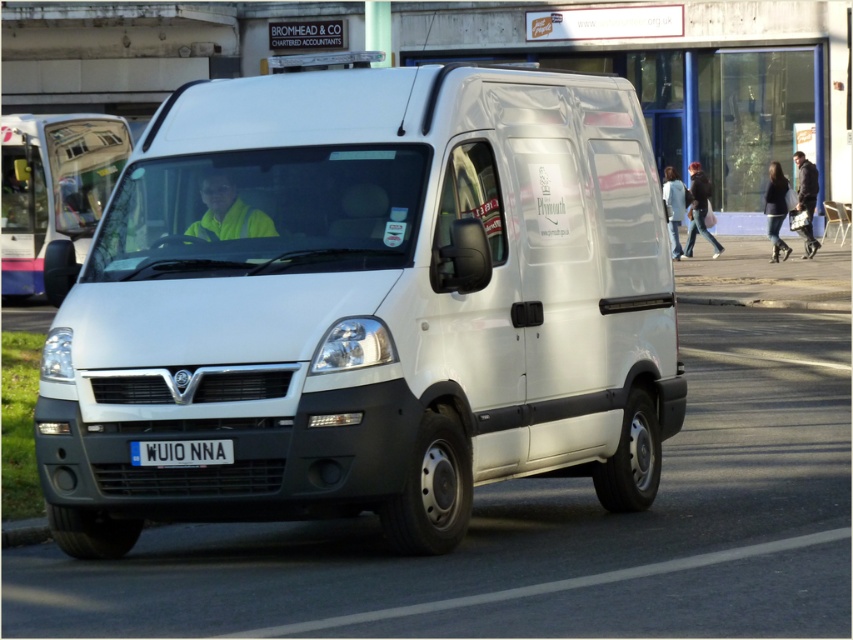
Between white matte van at center and white plastic license plate at center, which one appears on the left side from the viewer's perspective?

From the viewer's perspective, white plastic license plate at center appears more on the left side.

Does white matte van at center have a lesser height compared to white plastic license plate at center?

In fact, white matte van at center may be taller than white plastic license plate at center.

Where is `white matte van at center`? The image size is (853, 640). white matte van at center is located at coordinates (366, 305).

Which of these two, white matte van at center or matte white van at center, stands shorter?

white matte van at center

Who is more forward, (86, 404) or (3, 228)?

Positioned in front is point (86, 404).

Where is `white matte van at center`? The height and width of the screenshot is (640, 853). white matte van at center is located at coordinates (366, 305).

Is matte white van at center shorter than white plastic license plate at center?

In fact, matte white van at center may be taller than white plastic license plate at center.

Is point (22, 182) closer to viewer compared to point (198, 456)?

That is False.

In order to click on matte white van at center in this screenshot , I will do `click(53, 186)`.